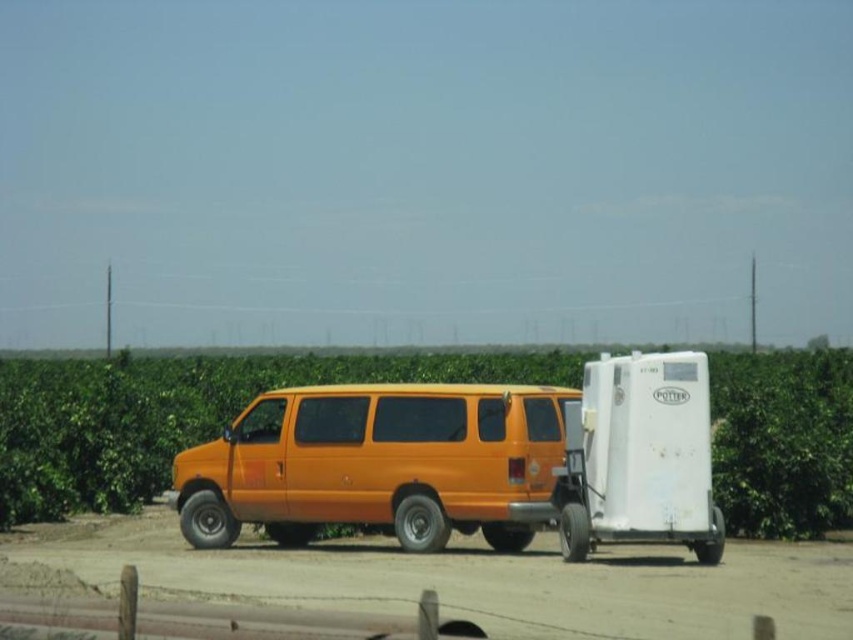
Where is `green leafy corn field at center`? green leafy corn field at center is located at coordinates (177, 413).

Describe the element at coordinates (177, 413) in the screenshot. I see `green leafy corn field at center` at that location.

The image size is (853, 640). I want to click on green leafy corn field at center, so click(x=177, y=413).